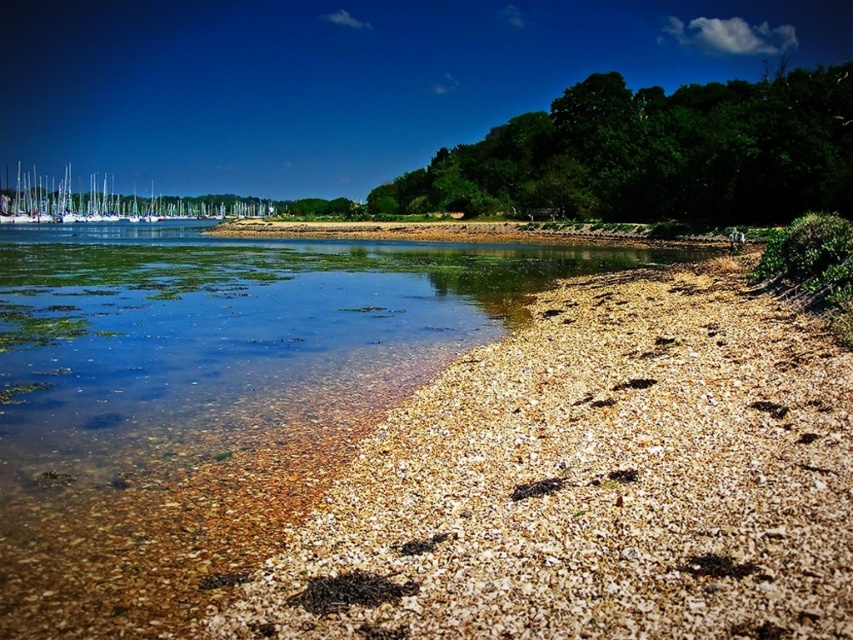
Which is in front, point (730, 577) or point (33, 204)?

Positioned in front is point (730, 577).

Between brown gravelly sand at lower left and white glossy boats at upper left, which one is positioned lower?

brown gravelly sand at lower left

Measure the distance between brown gravelly sand at lower left and camera.

4.25 meters

Find the location of `brown gravelly sand at lower left`. brown gravelly sand at lower left is located at coordinates (593, 481).

Is point (677, 448) positioned after point (815, 166)?

No, (677, 448) is in front of (815, 166).

Who is taller, brown gravelly sand at lower left or green leafy trees at upper right?

Standing taller between the two is green leafy trees at upper right.

Is point (766, 611) less distant than point (808, 208)?

Yes.

Identify the location of brown gravelly sand at lower left. The height and width of the screenshot is (640, 853). (593, 481).

Is point (415, 195) positioned behind point (244, 212)?

That is False.

Between green leafy trees at upper right and white glossy boats at upper left, which one has more height?

green leafy trees at upper right is taller.

Is point (827, 172) farther from viewer compared to point (223, 195)?

No, (827, 172) is closer to viewer.

Identify the location of green leafy trees at upper right. (654, 154).